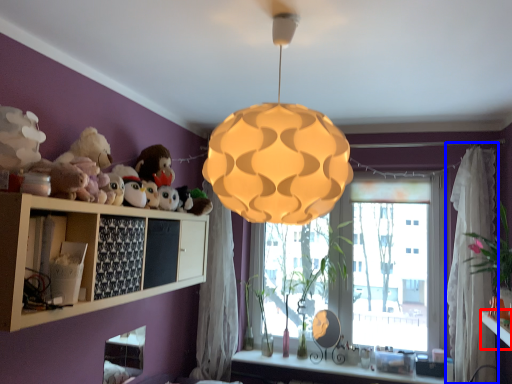
Question: Which of the following is the farthest to the observer, table (highlighted by a red box) or curtain (highlighted by a blue box)?

Choices:
 (A) table
 (B) curtain

Answer: (B)